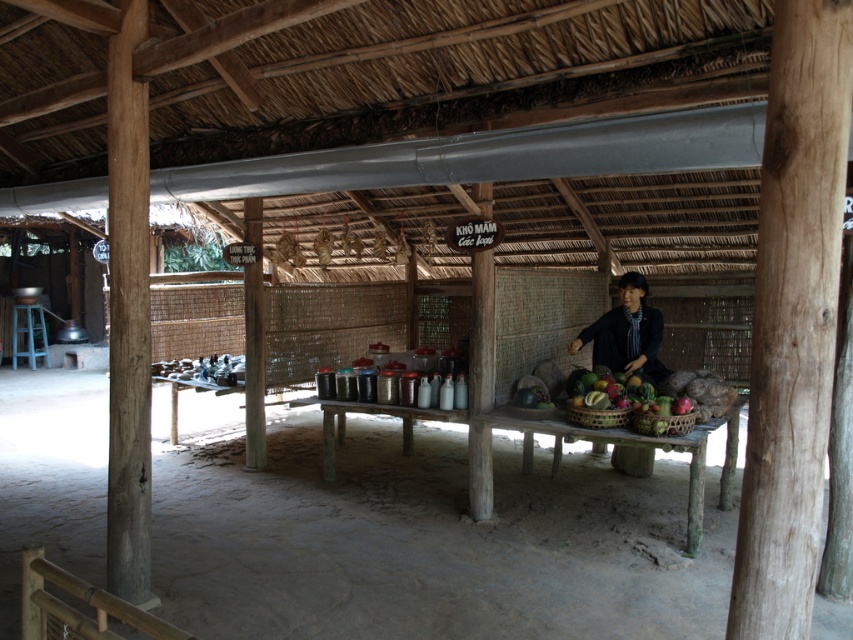
Which is more to the left, dark blue shirt at center or wooden woven basket at center?

wooden woven basket at center

In the scene shown: Between dark blue shirt at center and wooden woven basket at center, which one appears on the right side from the viewer's perspective?

From the viewer's perspective, dark blue shirt at center appears more on the right side.

I want to click on dark blue shirt at center, so click(625, 333).

Does dark blue shirt at center appear on the left side of brown woven basket at center?

No, dark blue shirt at center is not to the left of brown woven basket at center.

Is point (581, 332) farther from camera compared to point (608, 410)?

That is True.

What are the coordinates of `dark blue shirt at center` in the screenshot? It's located at (625, 333).

Identify the location of dark blue shirt at center. Image resolution: width=853 pixels, height=640 pixels. (625, 333).

Consider the image. Which of these two, wooden table at center or wooden woven basket at center, stands taller?

wooden table at center

Can you confirm if wooden table at center is bigger than wooden woven basket at center?

Correct, wooden table at center is larger in size than wooden woven basket at center.

Which is behind, point (711, 426) or point (643, 412)?

Positioned behind is point (711, 426).

Image resolution: width=853 pixels, height=640 pixels. I want to click on wooden table at center, so click(555, 444).